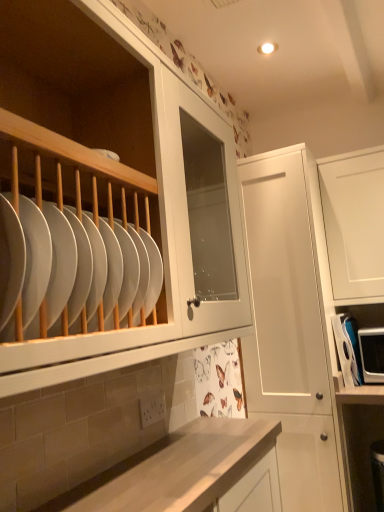
Question: Is white glossy plate at left wider than white plastic microwave at right?

Choices:
 (A) no
 (B) yes

Answer: (A)

Question: Can you confirm if white glossy plate at left is smaller than white plastic microwave at right?

Choices:
 (A) yes
 (B) no

Answer: (B)

Question: Does white glossy plate at left appear on the left side of white plastic microwave at right?

Choices:
 (A) no
 (B) yes

Answer: (B)

Question: Does white glossy plate at left have a lesser height compared to white plastic microwave at right?

Choices:
 (A) yes
 (B) no

Answer: (A)

Question: Does white glossy plate at left lie behind white plastic microwave at right?

Choices:
 (A) no
 (B) yes

Answer: (A)

Question: From the image's perspective, is white glossy plate at left on white plastic microwave at right?

Choices:
 (A) no
 (B) yes

Answer: (B)

Question: Is white glossy plate at left next to white matte cabinet at center?

Choices:
 (A) yes
 (B) no

Answer: (B)

Question: From the image's perspective, is white glossy plate at left beneath white matte cabinet at center?

Choices:
 (A) no
 (B) yes

Answer: (A)

Question: Is white glossy plate at left oriented away from white matte cabinet at center?

Choices:
 (A) no
 (B) yes

Answer: (A)

Question: Is white glossy plate at left to the right of white matte cabinet at center from the viewer's perspective?

Choices:
 (A) no
 (B) yes

Answer: (A)

Question: Is white glossy plate at left thinner than white matte cabinet at center?

Choices:
 (A) yes
 (B) no

Answer: (A)

Question: From the image's perspective, does white glossy plate at left appear higher than white matte cabinet at center?

Choices:
 (A) yes
 (B) no

Answer: (A)

Question: Considering the relative sizes of white plastic microwave at right and white glossy plate at left in the image provided, is white plastic microwave at right smaller than white glossy plate at left?

Choices:
 (A) yes
 (B) no

Answer: (A)